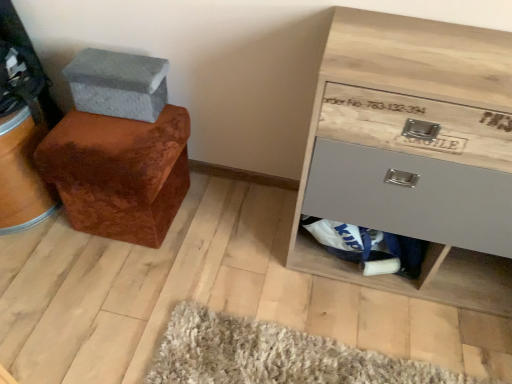
Image resolution: width=512 pixels, height=384 pixels. Identify the location of free point to the left of matte gray drawer at lower right. (271, 256).